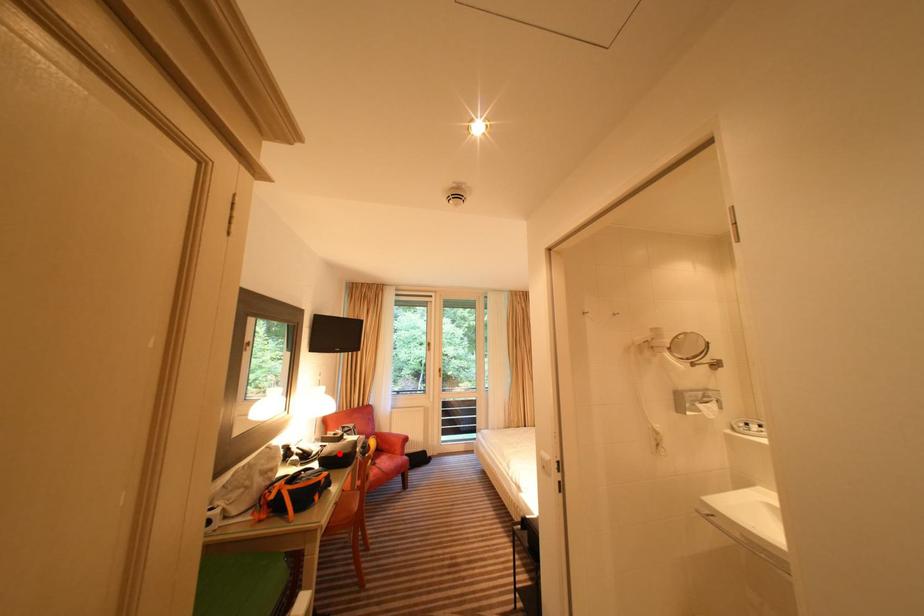
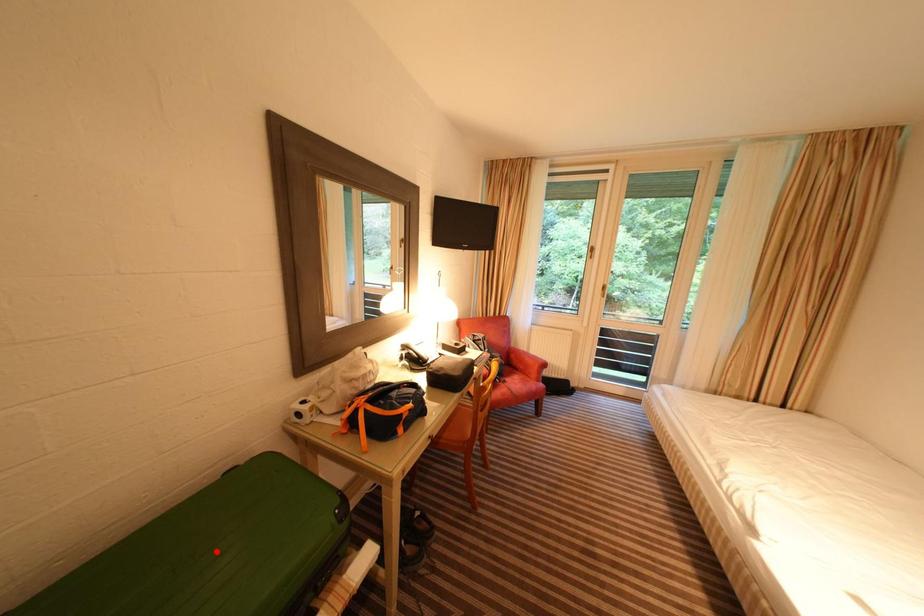
I am providing you with two images of the same scene from different viewpoints. A red point is marked on the first image and another point is marked on the second image. Does the point marked in image1 correspond to the same location as the one in image2?

No